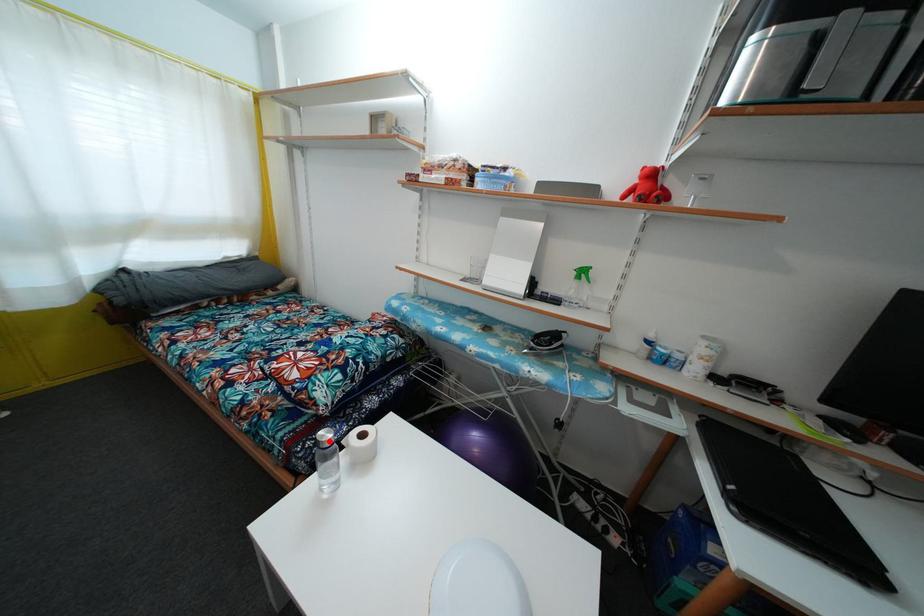
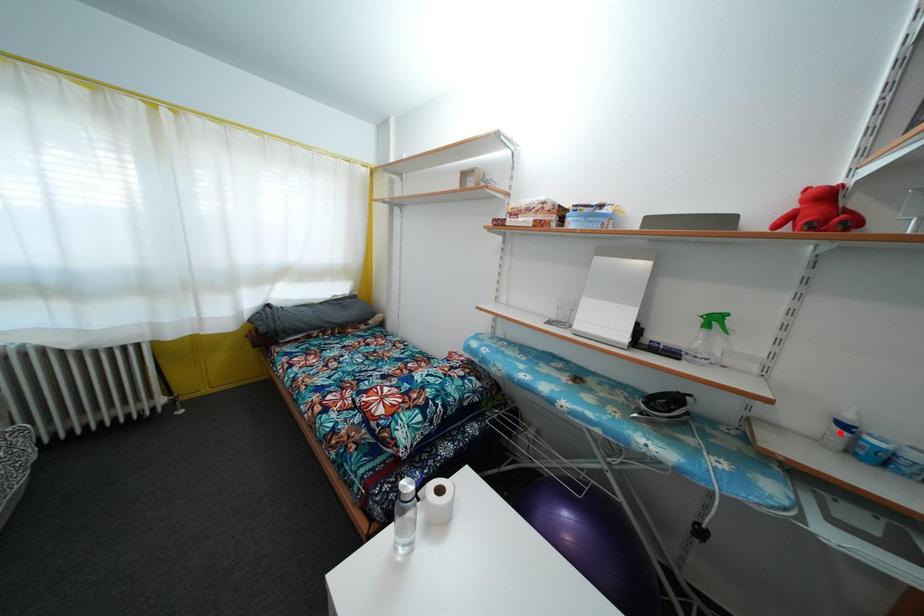
I am providing you with two images of the same scene from different viewpoints. A red point is marked on the first image and another point is marked on the second image. Are the points marked in image1 and image2 representing the same 3D position?

No